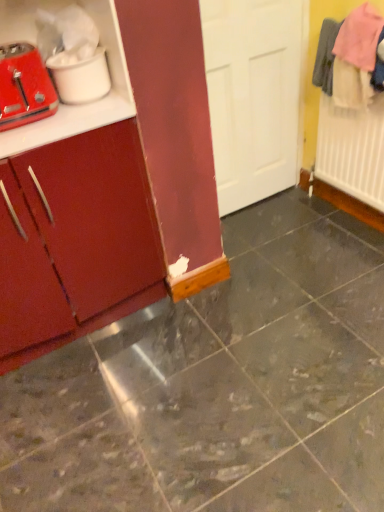
Question: Is there a large distance between matte white toaster at left and matte red toaster at left?

Choices:
 (A) yes
 (B) no

Answer: (B)

Question: Is the position of matte white toaster at left more distant than that of matte red toaster at left?

Choices:
 (A) no
 (B) yes

Answer: (B)

Question: Can we say matte white toaster at left lies outside matte red toaster at left?

Choices:
 (A) no
 (B) yes

Answer: (B)

Question: Considering the relative sizes of matte white toaster at left and matte red toaster at left in the image provided, is matte white toaster at left taller than matte red toaster at left?

Choices:
 (A) no
 (B) yes

Answer: (A)

Question: Considering the relative positions of matte white toaster at left and matte red toaster at left in the image provided, is matte white toaster at left to the left of matte red toaster at left from the viewer's perspective?

Choices:
 (A) yes
 (B) no

Answer: (B)

Question: From the image's perspective, would you say matte white toaster at left is positioned over matte red toaster at left?

Choices:
 (A) no
 (B) yes

Answer: (B)

Question: Is the depth of matte red toaster at left greater than that of matte white toaster at left?

Choices:
 (A) no
 (B) yes

Answer: (A)

Question: Is matte red toaster at left completely or partially outside of matte white toaster at left?

Choices:
 (A) no
 (B) yes

Answer: (B)

Question: Is matte red toaster at left placed right next to matte white toaster at left?

Choices:
 (A) no
 (B) yes

Answer: (A)

Question: Considering the relative sizes of matte red toaster at left and matte white toaster at left in the image provided, is matte red toaster at left bigger than matte white toaster at left?

Choices:
 (A) no
 (B) yes

Answer: (B)

Question: Can you confirm if matte red toaster at left is positioned to the right of matte white toaster at left?

Choices:
 (A) yes
 (B) no

Answer: (B)

Question: Is matte red toaster at left aimed at matte white toaster at left?

Choices:
 (A) yes
 (B) no

Answer: (B)

Question: From the image's perspective, would you say matte wood cabinet at left is positioned over marble tile floor at center?

Choices:
 (A) yes
 (B) no

Answer: (A)